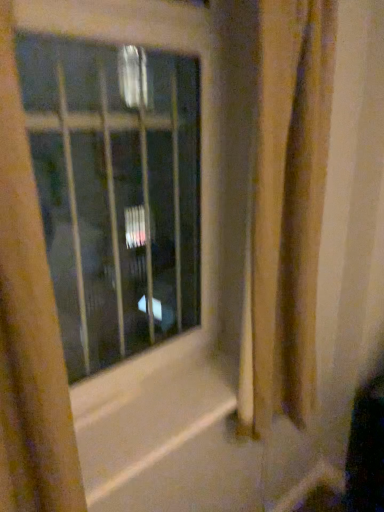
Question: Would you say brown textured shower curtain at right is part of transparent glass window at center's contents?

Choices:
 (A) no
 (B) yes

Answer: (A)

Question: Is transparent glass window at center not within brown textured shower curtain at right?

Choices:
 (A) yes
 (B) no

Answer: (A)

Question: Is transparent glass window at center in contact with brown textured shower curtain at right?

Choices:
 (A) yes
 (B) no

Answer: (B)

Question: Can you confirm if transparent glass window at center is thinner than brown textured shower curtain at right?

Choices:
 (A) no
 (B) yes

Answer: (B)

Question: Does transparent glass window at center come behind brown textured shower curtain at right?

Choices:
 (A) no
 (B) yes

Answer: (A)

Question: From a real-world perspective, does transparent glass window at center stand above brown textured shower curtain at right?

Choices:
 (A) yes
 (B) no

Answer: (A)

Question: From the image's perspective, is transparent glass window at center located beneath yellow textured curtain at left?

Choices:
 (A) yes
 (B) no

Answer: (B)

Question: Is yellow textured curtain at left located within transparent glass window at center?

Choices:
 (A) yes
 (B) no

Answer: (B)

Question: Is the position of transparent glass window at center less distant than that of yellow textured curtain at left?

Choices:
 (A) yes
 (B) no

Answer: (B)

Question: Does transparent glass window at center come behind yellow textured curtain at left?

Choices:
 (A) yes
 (B) no

Answer: (A)

Question: Does transparent glass window at center turn towards yellow textured curtain at left?

Choices:
 (A) no
 (B) yes

Answer: (A)

Question: Considering the relative sizes of transparent glass window at center and yellow textured curtain at left in the image provided, is transparent glass window at center bigger than yellow textured curtain at left?

Choices:
 (A) no
 (B) yes

Answer: (A)

Question: Can you confirm if brown textured shower curtain at right is shorter than transparent glass window at center?

Choices:
 (A) yes
 (B) no

Answer: (B)